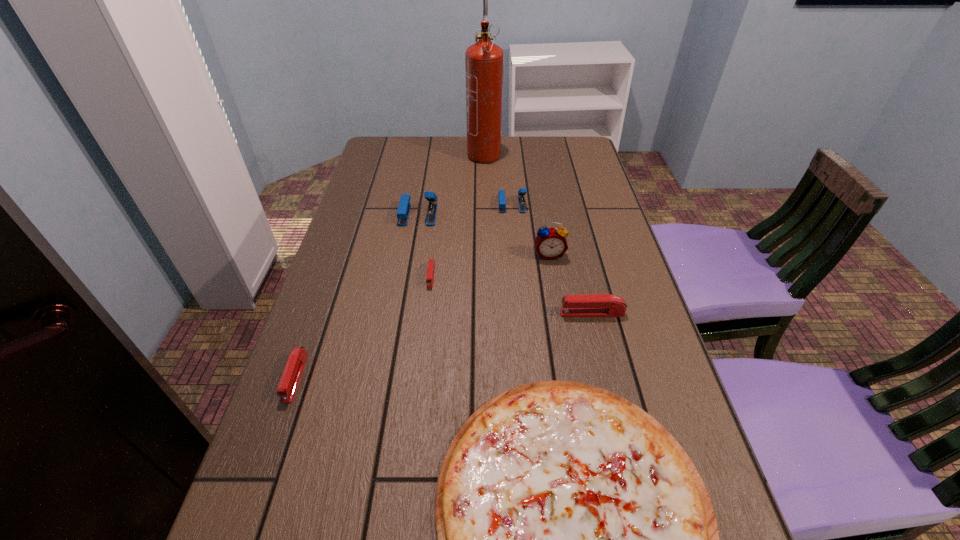
Identify the location of red fire extinguisher. The image size is (960, 540). (484, 61).

Where is `fire extinguisher`? The image size is (960, 540). fire extinguisher is located at coordinates (484, 61).

Identify the location of alarm clock. This screenshot has width=960, height=540. (550, 243).

Where is `the second tallest object`? The width and height of the screenshot is (960, 540). the second tallest object is located at coordinates click(550, 243).

Find the location of a particular element. the third tallest object is located at coordinates (403, 210).

Locate an element on the screen. the tallest stapler is located at coordinates (403, 210).

You are a GUI agent. You are given a task and a screenshot of the screen. Output one action in this format:
    pyautogui.click(x=<x>, y=<y>)
    Task: Click on the fourth tallest object
    
    Given the screenshot: What is the action you would take?
    pyautogui.click(x=522, y=191)

Find the location of a particular element. Image resolution: width=960 pixels, height=540 pixels. the second tallest stapler is located at coordinates (522, 191).

Locate an element on the screen. the rightmost stapler is located at coordinates [x=592, y=305].

You are a GUI agent. You are given a task and a screenshot of the screen. Output one action in this format:
    pyautogui.click(x=<x>, y=<y>)
    Task: Click on the fourth shortest object
    The width and height of the screenshot is (960, 540).
    Given the screenshot: What is the action you would take?
    [x=592, y=305]